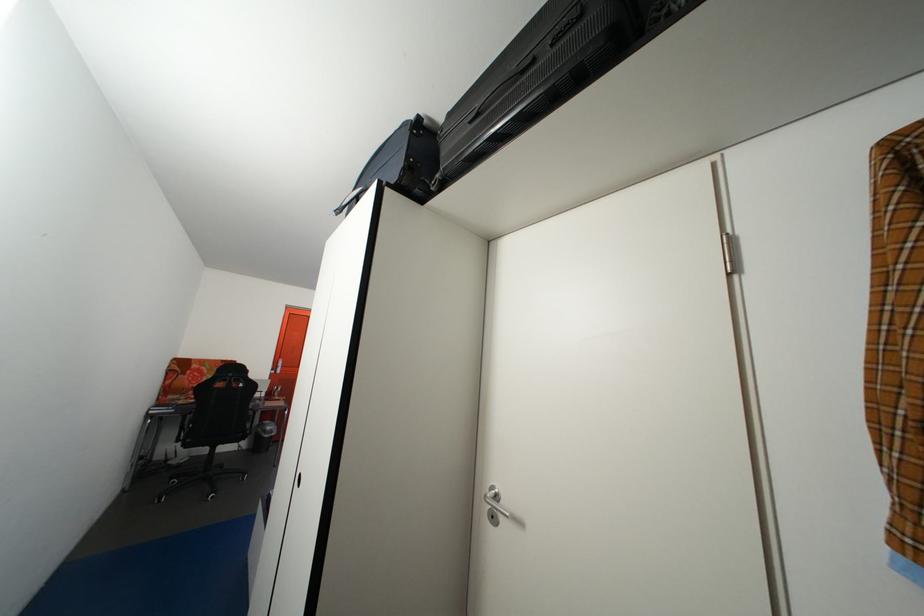
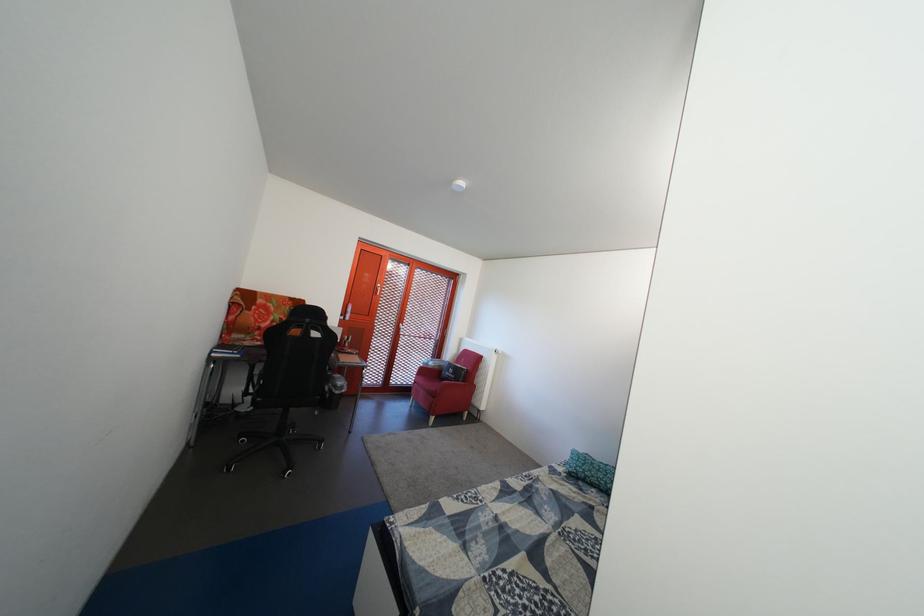
In a continuous first-person perspective shot, in which direction is the camera moving?

The movement direction of the cameraman is left, forward.